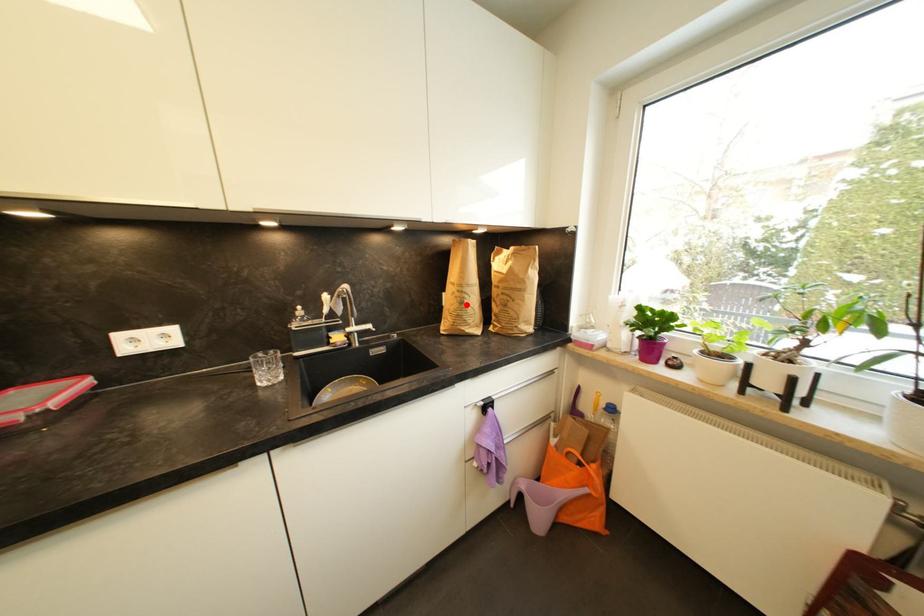
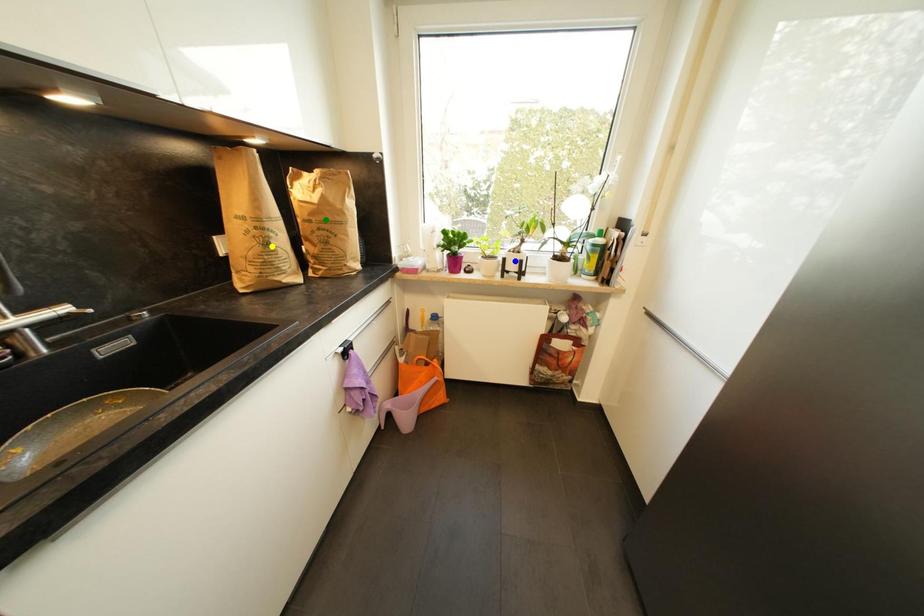
Question: I am providing you with two images of the same scene from different viewpoints. A red point is marked on the first image. You are given multiple points on the second image. Can you choose the point in image 2 that corresponds to the point in image 1?

Choices:
 (A) blue point
 (B) yellow point
 (C) green point

Answer: (B)